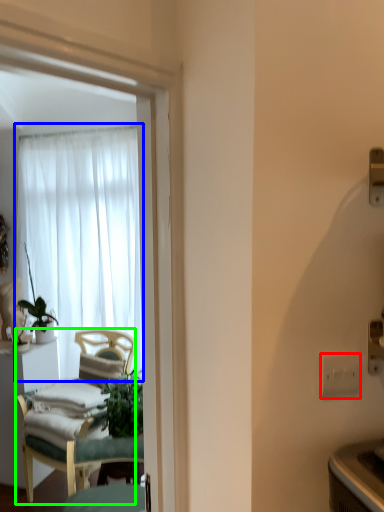
Question: Which object is the closest to the electric outlet (highlighted by a red box)? Choose among these: curtain (highlighted by a blue box) or chair (highlighted by a green box).

Choices:
 (A) curtain
 (B) chair

Answer: (B)